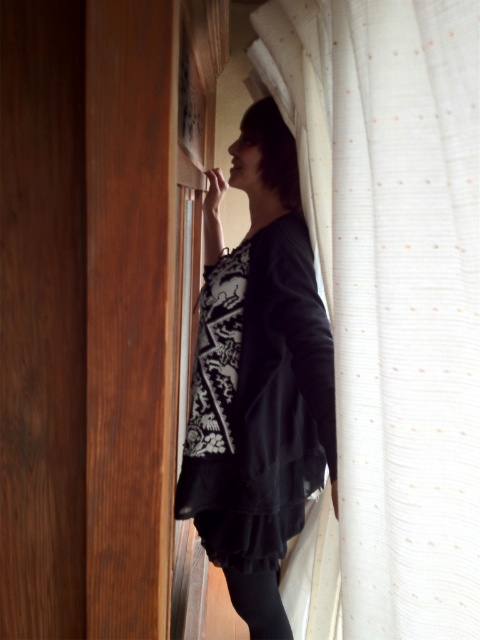
Is white sheer curtain at right wider than black matte dress at center?

In fact, white sheer curtain at right might be narrower than black matte dress at center.

You are a GUI agent. You are given a task and a screenshot of the screen. Output one action in this format:
    pyautogui.click(x=<x>, y=<y>)
    Task: Click on the white sheer curtain at right
    The height and width of the screenshot is (640, 480).
    Given the screenshot: What is the action you would take?
    point(394,289)

Locate an element on the screen. Image resolution: width=480 pixels, height=640 pixels. white sheer curtain at right is located at coordinates (394, 289).